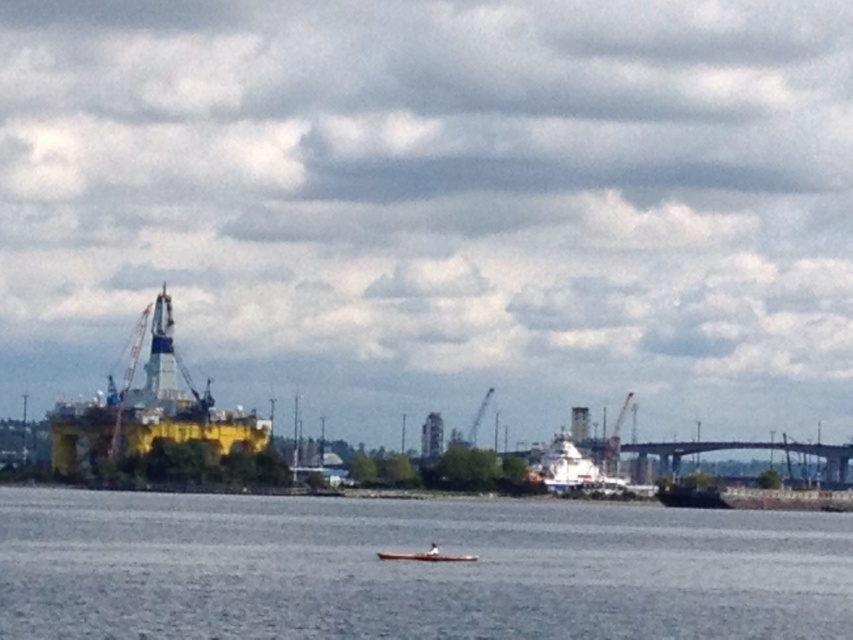
You are standing on the shore of the waterfront scene and want to cross to the other side. The gray water at center and wooden canoe at center are in your path. Which object should you use to cross the water?

You should use the wooden canoe at center to cross the water because the gray water at center is just the body of water itself and cannot be used as a means of crossing.

You are standing on the pier and want to reach the metallic gray crane at center right. Which direction should you move relative to the gray water at center?

You should move to the right of the gray water at center because the metallic gray crane at center right is located to the right of it.

You are a photographer trying to capture a wide shot of the waterfront scene. You want to ensure both the yellow matte oil rig at left and the metallic gray crane at center right are clearly visible in your photo. Given their sizes, which object should you prioritize framing closer to the center of the image to maintain their visibility?

The yellow matte oil rig at left is larger in size compared to the metallic gray crane at center right. To maintain visibility of both objects, prioritize framing the smaller metallic gray crane at center right closer to the center of the image since its smaller size may require more emphasis to ensure it stands out against the larger oil rig.